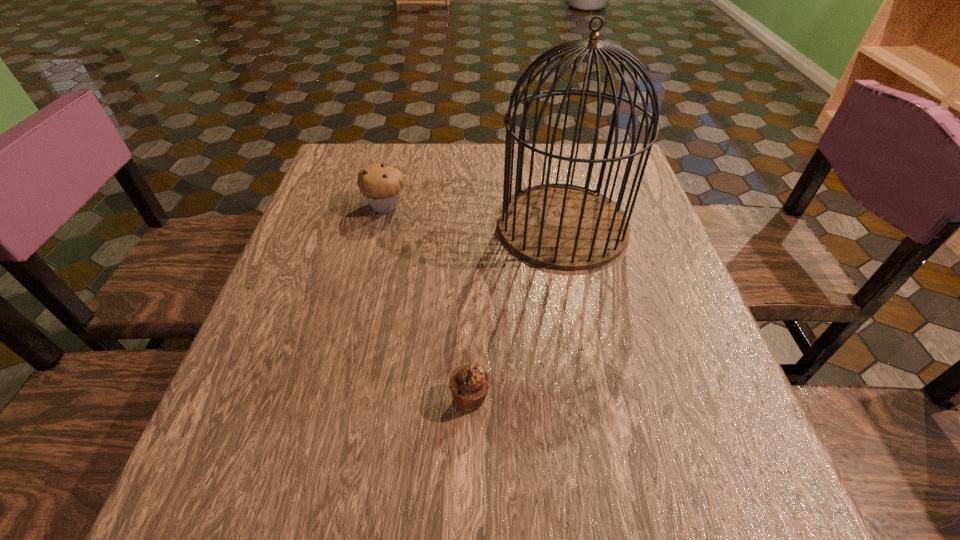
At what (x,y) coordinates should I click in order to perform the action: click on vacant space located on the back of the nearer muffin. Please return your answer as a coordinate pair (x, y). This screenshot has width=960, height=540. Looking at the image, I should click on (471, 329).

The height and width of the screenshot is (540, 960). Find the location of `object that is at the far edge`. object that is at the far edge is located at coordinates (567, 227).

The width and height of the screenshot is (960, 540). I want to click on object present at the left edge, so click(381, 185).

This screenshot has height=540, width=960. What are the coordinates of `object located in the right edge section of the desktop` in the screenshot? It's located at (567, 227).

The width and height of the screenshot is (960, 540). What are the coordinates of `object situated at the far right corner` in the screenshot? It's located at (567, 227).

I want to click on vacant region at the far edge of the desktop, so click(x=427, y=159).

Locate an element on the screen. The image size is (960, 540). vacant space at the near edge of the desktop is located at coordinates (584, 504).

This screenshot has width=960, height=540. What are the coordinates of `vacant space at the left edge` in the screenshot? It's located at [x=292, y=263].

In the image, there is a desktop. Where is `free space at the right edge`? free space at the right edge is located at coordinates (685, 363).

This screenshot has height=540, width=960. I want to click on vacant region at the far right corner, so click(641, 184).